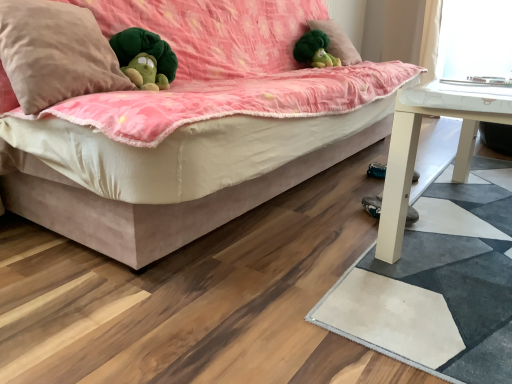
Question: Which direction should I rotate to look at green plush at upper center, the second pillow in the front-to-back sequence?

Choices:
 (A) left
 (B) right

Answer: (B)

Question: Is black suede shoe at lower right wider than green plush toy at upper center?

Choices:
 (A) yes
 (B) no

Answer: (B)

Question: Can you confirm if black suede shoe at lower right is taller than green plush toy at upper center?

Choices:
 (A) no
 (B) yes

Answer: (A)

Question: Can you confirm if black suede shoe at lower right is positioned to the right of green plush toy at upper center?

Choices:
 (A) no
 (B) yes

Answer: (B)

Question: Considering the relative sizes of black suede shoe at lower right and green plush toy at upper center in the image provided, is black suede shoe at lower right smaller than green plush toy at upper center?

Choices:
 (A) no
 (B) yes

Answer: (B)

Question: Is black suede shoe at lower right not near green plush toy at upper center?

Choices:
 (A) yes
 (B) no

Answer: (A)

Question: From the image's perspective, is black suede shoe at lower right located above green plush toy at upper center?

Choices:
 (A) yes
 (B) no

Answer: (B)

Question: Is green plush toy at upper center inside green plush at upper center, the second pillow in the front-to-back sequence?

Choices:
 (A) yes
 (B) no

Answer: (B)

Question: Considering the relative sizes of green plush at upper center, the first pillow viewed from the top, and green plush toy at upper center in the image provided, is green plush at upper center, the first pillow viewed from the top, thinner than green plush toy at upper center?

Choices:
 (A) no
 (B) yes

Answer: (A)

Question: Can you confirm if green plush at upper center, the second pillow in the front-to-back sequence, is shorter than green plush toy at upper center?

Choices:
 (A) no
 (B) yes

Answer: (A)

Question: From a real-world perspective, is green plush at upper center, arranged as the 2th pillow when viewed from the left, located beneath green plush toy at upper center?

Choices:
 (A) no
 (B) yes

Answer: (A)

Question: Is green plush at upper center, which appears as the second pillow when ordered from the bottom, to the right of green plush toy at upper center from the viewer's perspective?

Choices:
 (A) yes
 (B) no

Answer: (A)

Question: Is green plush at upper center, the second pillow in the front-to-back sequence, with green plush toy at upper center?

Choices:
 (A) no
 (B) yes

Answer: (B)

Question: Is suede-like beige studio couch at center positioned with its back to beige soft pillow at upper left, the first pillow positioned from the bottom?

Choices:
 (A) yes
 (B) no

Answer: (A)